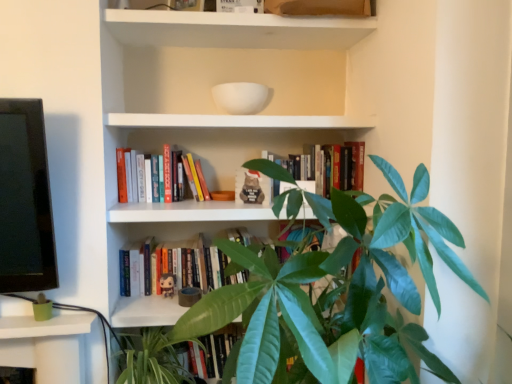
Question: Are hardcover books at center, positioned as the 3th book in bottom-to-top order, and hardcover books at center, which is the 2th book in bottom-to-top order, far apart?

Choices:
 (A) no
 (B) yes

Answer: (A)

Question: Can you confirm if hardcover books at center, positioned as the 3th book in bottom-to-top order, is taller than hardcover books at center, which is counted as the second book, starting from the top?

Choices:
 (A) yes
 (B) no

Answer: (A)

Question: Is hardcover books at center, positioned as the 3th book in bottom-to-top order, touching hardcover books at center, which is the 2th book in bottom-to-top order?

Choices:
 (A) no
 (B) yes

Answer: (A)

Question: From a real-world perspective, does hardcover books at center, positioned as the 3th book in bottom-to-top order, stand above hardcover books at center, which is the 2th book in bottom-to-top order?

Choices:
 (A) yes
 (B) no

Answer: (B)

Question: Considering the relative sizes of hardcover books at center, acting as the first book starting from the top, and hardcover books at center, which is counted as the second book, starting from the top, in the image provided, is hardcover books at center, acting as the first book starting from the top, bigger than hardcover books at center, which is counted as the second book, starting from the top,?

Choices:
 (A) no
 (B) yes

Answer: (B)

Question: Is green leafy plant at lower center taller or shorter than hardcover books at center, positioned as the 3th book in bottom-to-top order?

Choices:
 (A) tall
 (B) short

Answer: (A)

Question: In terms of size, does green leafy plant at lower center appear bigger or smaller than hardcover books at center, positioned as the 3th book in bottom-to-top order?

Choices:
 (A) big
 (B) small

Answer: (A)

Question: Based on their positions, is green leafy plant at lower center located to the left or right of hardcover books at center, acting as the first book starting from the top?

Choices:
 (A) right
 (B) left

Answer: (B)

Question: Is point (120, 365) closer or farther from the camera than point (327, 168)?

Choices:
 (A) farther
 (B) closer

Answer: (B)

Question: Is point (198, 193) closer or farther from the camera than point (375, 233)?

Choices:
 (A) closer
 (B) farther

Answer: (B)

Question: Relative to green glossy houseplant at center, is hardcover books at center, which is counted as the second book, starting from the top, in front or behind?

Choices:
 (A) front
 (B) behind

Answer: (B)

Question: Choose the correct answer: Is hardcover books at center, which is counted as the second book, starting from the top, inside green glossy houseplant at center or outside it?

Choices:
 (A) inside
 (B) outside

Answer: (B)

Question: Is hardcover books at center, which is counted as the second book, starting from the top, to the left or to the right of green glossy houseplant at center in the image?

Choices:
 (A) left
 (B) right

Answer: (A)

Question: Choose the correct answer: Is hardcover books at center, which is the 2th book in bottom-to-top order, inside hardcover book at center, which is the 3th book from top to bottom, or outside it?

Choices:
 (A) outside
 (B) inside

Answer: (A)

Question: Considering the positions of hardcover books at center, which is the 2th book in bottom-to-top order, and hardcover book at center, which is the 3th book from top to bottom, in the image, is hardcover books at center, which is the 2th book in bottom-to-top order, wider or thinner than hardcover book at center, which is the 3th book from top to bottom,?

Choices:
 (A) thin
 (B) wide

Answer: (A)